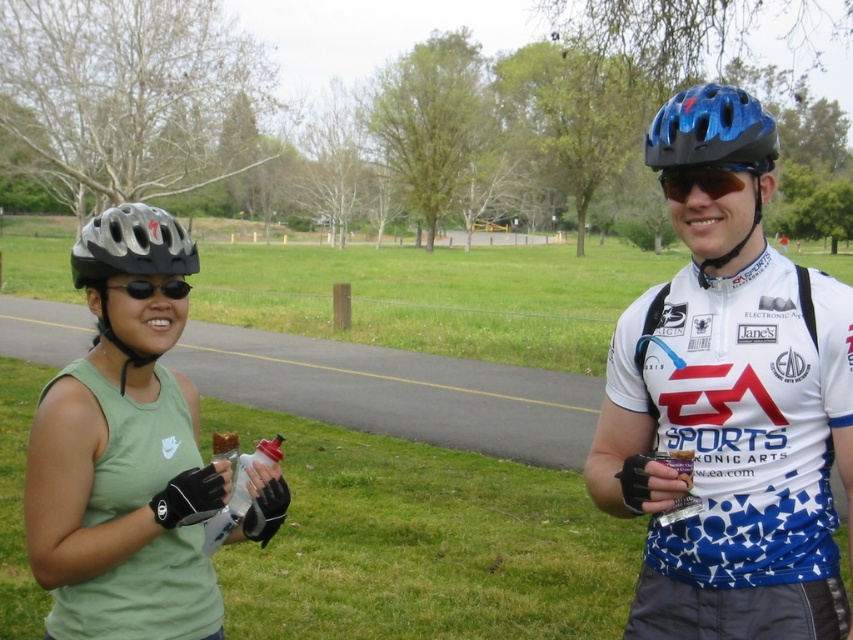
You are a photographer positioned to the right of the two cyclists. You want to take a photo that includes both the matte black helmet at left and the sunglasses at center. Which object should you adjust your camera angle to include first if you need to pan from left to right?

The matte black helmet at left should be adjusted first since it is positioned to the left of the sunglasses at center, requiring the camera to pan left before center.

You are a photographer trying to capture a clear shot of the matte black helmet at left and the sunglasses at center. Which object should you focus on first if you want to ensure both are in focus without adjusting the camera settings?

The matte black helmet at left is shorter than sunglasses at center, so you should focus on the sunglasses at center first because it is farther away, allowing the depth of field to cover both objects.

You are a photographer trying to capture a clear shot of the blue matte helmet at upper right and the black matte sunglasses at left. Since you want to focus on the taller object, which one should you adjust your camera angle to prioritize?

The blue matte helmet at upper right is taller than the black matte sunglasses at left, so you should adjust your camera angle to prioritize the blue matte helmet at upper right.